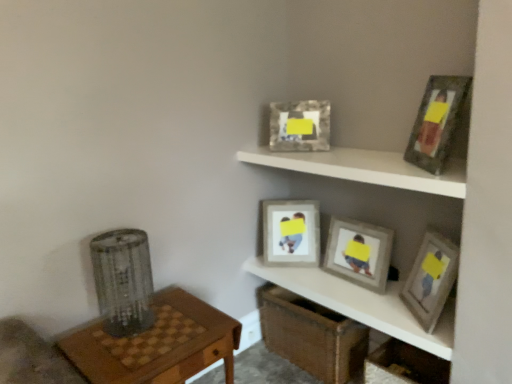
Locate an element on the screen. The width and height of the screenshot is (512, 384). free point above white matte shelf at upper center, placed as the 1th shelf when sorted from top to bottom (from a real-world perspective) is located at coordinates tap(358, 157).